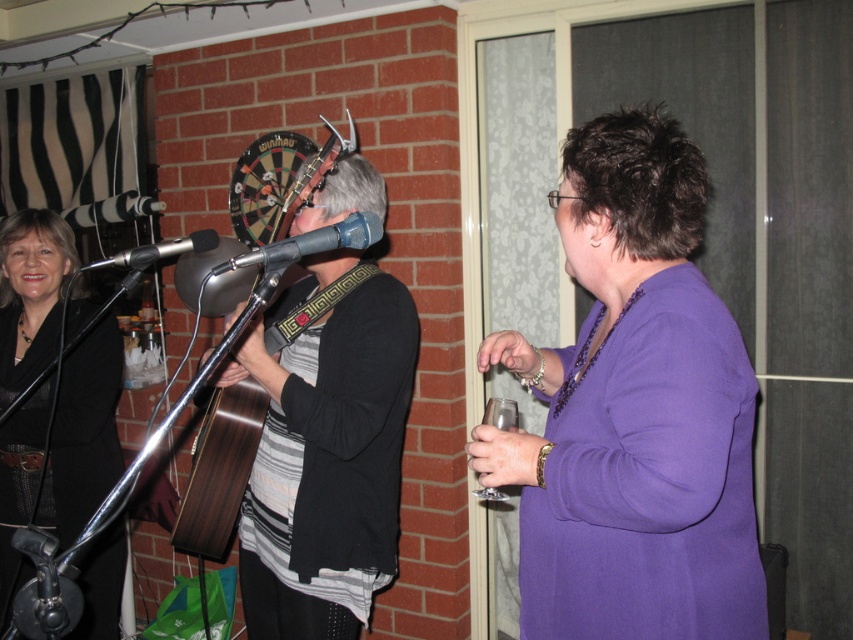
Who is positioned more to the left, matte black jacket at left or metallic silver microphone at center?

matte black jacket at left

Between point (61, 321) and point (195, 250), which one is positioned in front?

Point (195, 250)

This screenshot has width=853, height=640. Find the location of `matte black jacket at left`. matte black jacket at left is located at coordinates (61, 449).

Between point (320, 252) and point (136, 248), which one is positioned behind?

Positioned behind is point (320, 252).

Who is positioned more to the right, matte plastic microphone at center or metallic silver microphone at center?

matte plastic microphone at center

Looking at this image, who is more distant from viewer, (347, 230) or (189, 237)?

Positioned behind is point (347, 230).

At what (x,y) coordinates should I click in order to perform the action: click on matte plastic microphone at center. Please return your answer as a coordinate pair (x, y). The height and width of the screenshot is (640, 853). Looking at the image, I should click on [x=309, y=244].

Does purple matte dress at center have a greater width compared to metallic silver microphone at center?

Correct, the width of purple matte dress at center exceeds that of metallic silver microphone at center.

Does point (606, 161) lie in front of point (154, 252)?

Yes, it is in front of point (154, 252).

Identify the location of purple matte dress at center. (633, 412).